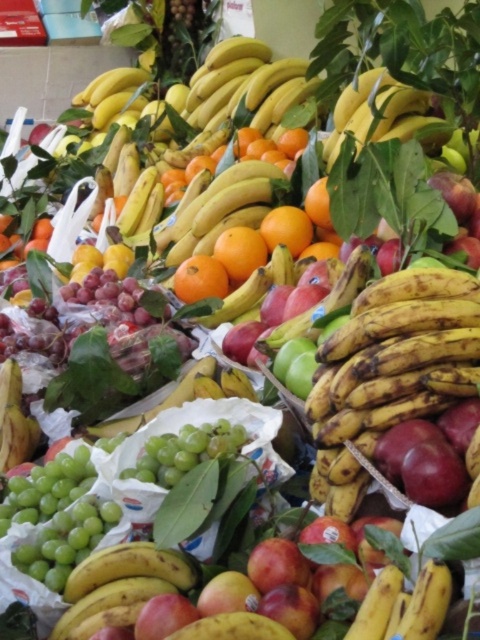
Question: Which object is the closest to the yellow matte bananas at lower left?

Choices:
 (A) yellow matte bananas at center
 (B) ripe yellow bananas at center

Answer: (B)

Question: Does ripe yellow bananas at center have a lesser width compared to yellow matte bananas at lower left?

Choices:
 (A) yes
 (B) no

Answer: (B)

Question: Which point appears closest to the camera in this image?

Choices:
 (A) (90, 621)
 (B) (336, 120)
 (C) (451, 282)

Answer: (A)

Question: Which of these objects is positioned farthest from the yellow matte bananas at center?

Choices:
 (A) yellow matte bananas at lower left
 (B) ripe yellow bananas at center

Answer: (A)

Question: Does ripe yellow bananas at center appear over yellow matte bananas at lower left?

Choices:
 (A) yes
 (B) no

Answer: (A)

Question: Is ripe yellow bananas at center to the right of yellow matte bananas at lower left from the viewer's perspective?

Choices:
 (A) yes
 (B) no

Answer: (A)